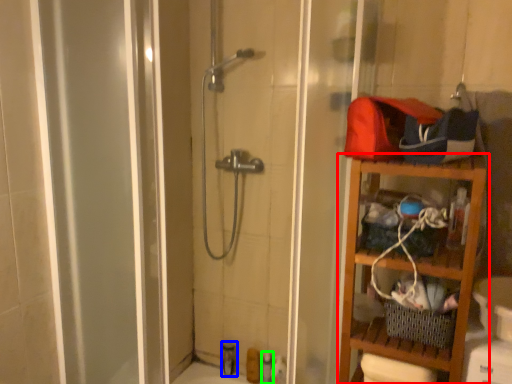
Question: Considering the real-world distances, which object is closest to shelf (highlighted by a red box)? toiletry (highlighted by a blue box) or toiletry (highlighted by a green box).

Choices:
 (A) toiletry
 (B) toiletry

Answer: (B)